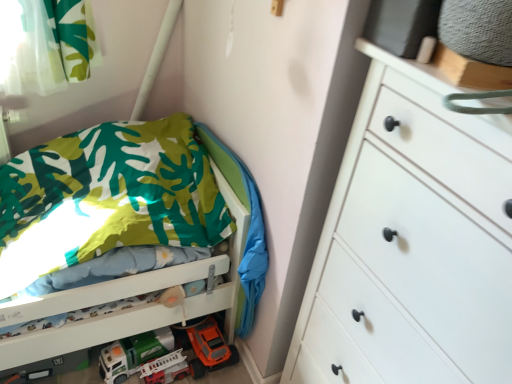
The width and height of the screenshot is (512, 384). Find the location of `free location above white plastic toy car at lower center, marked as the second toy car in a right-to-left arrangement (from a real-world perspective)`. free location above white plastic toy car at lower center, marked as the second toy car in a right-to-left arrangement (from a real-world perspective) is located at coordinates (136, 342).